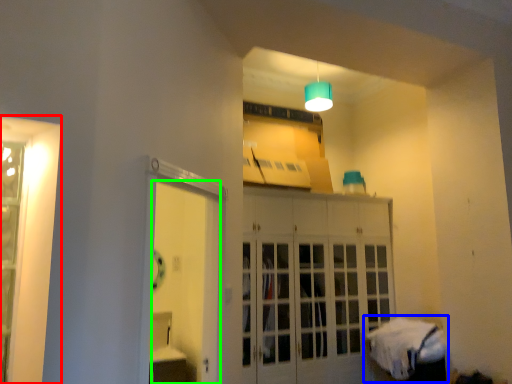
Question: Considering the real-world distances, which object is closest to window (highlighted by a red box)? bed (highlighted by a blue box) or door (highlighted by a green box).

Choices:
 (A) bed
 (B) door

Answer: (B)